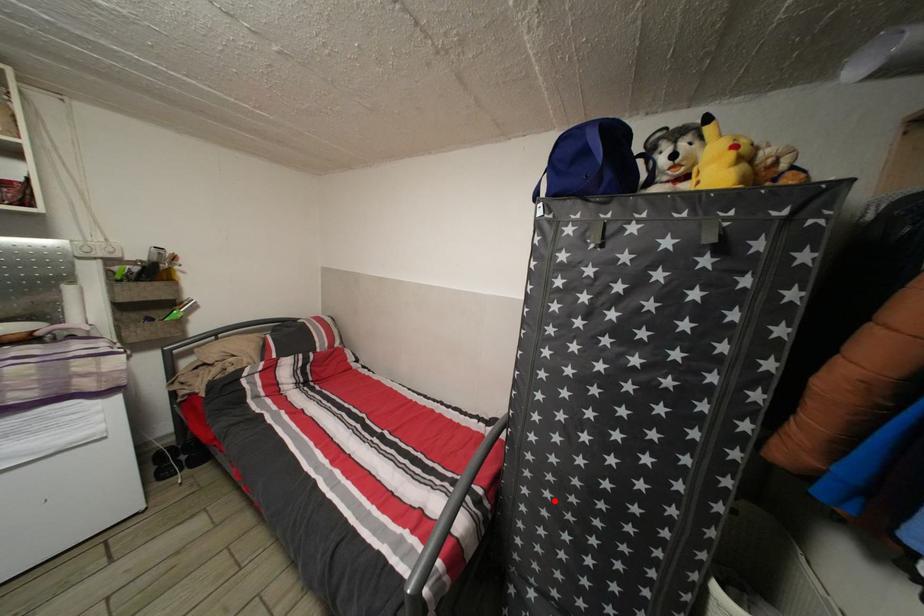
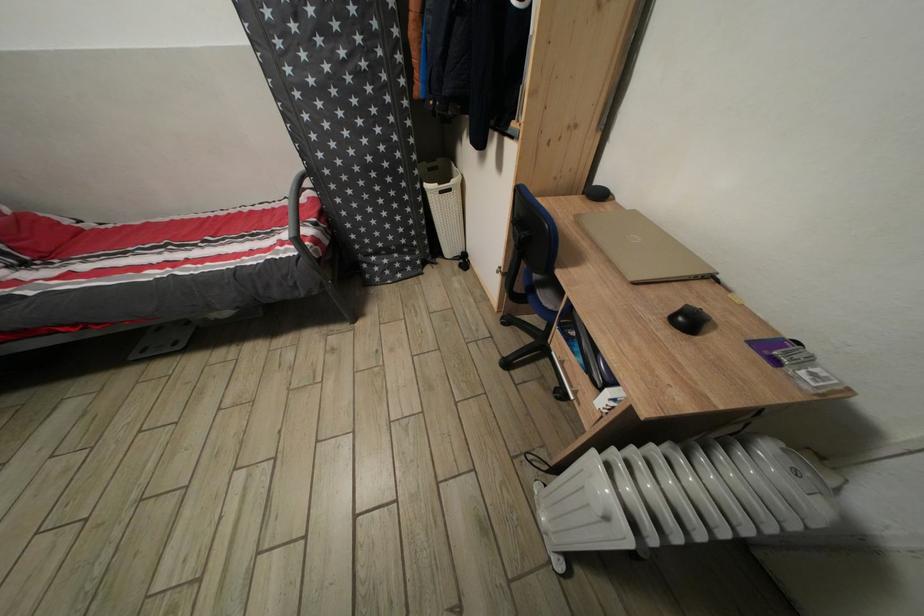
Find the pixel in the second image that matches the highlighted location in the first image.

(357, 198)